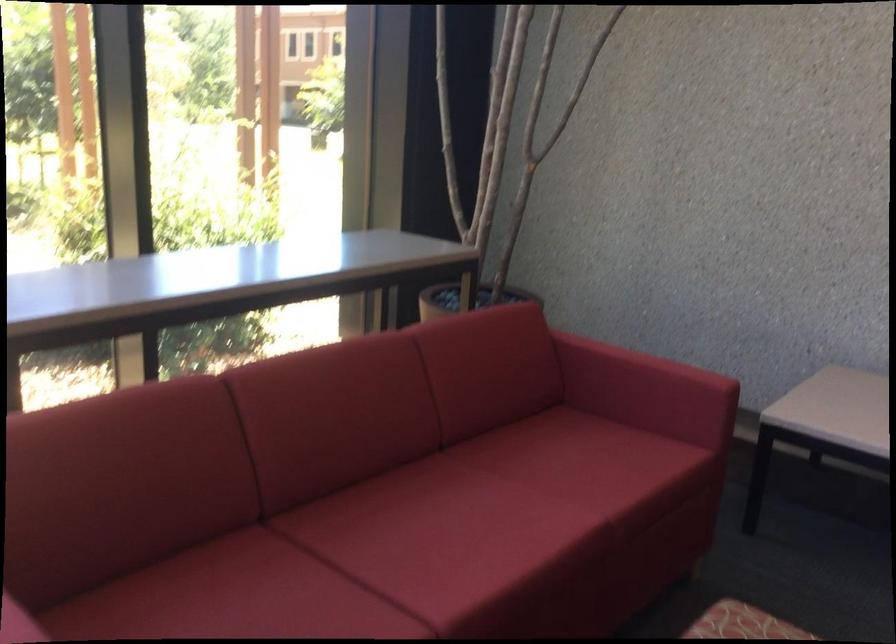
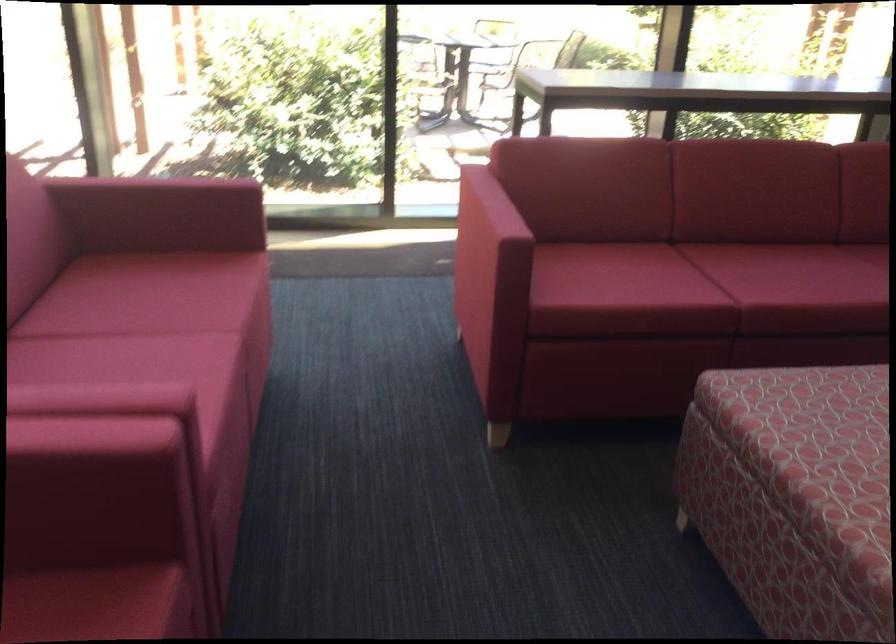
In the second image, find the point that corresponds to pixel 378 550 in the first image.

(728, 269)